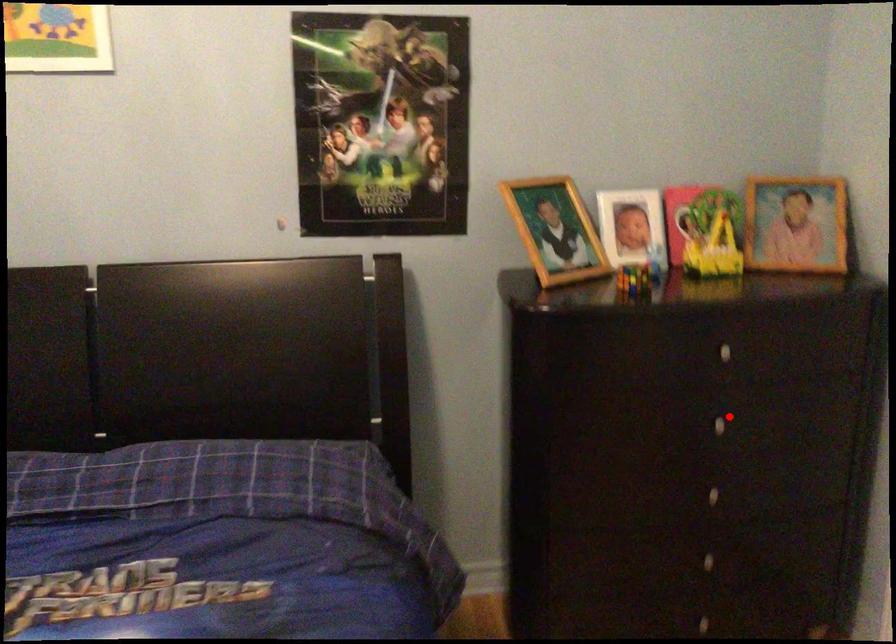
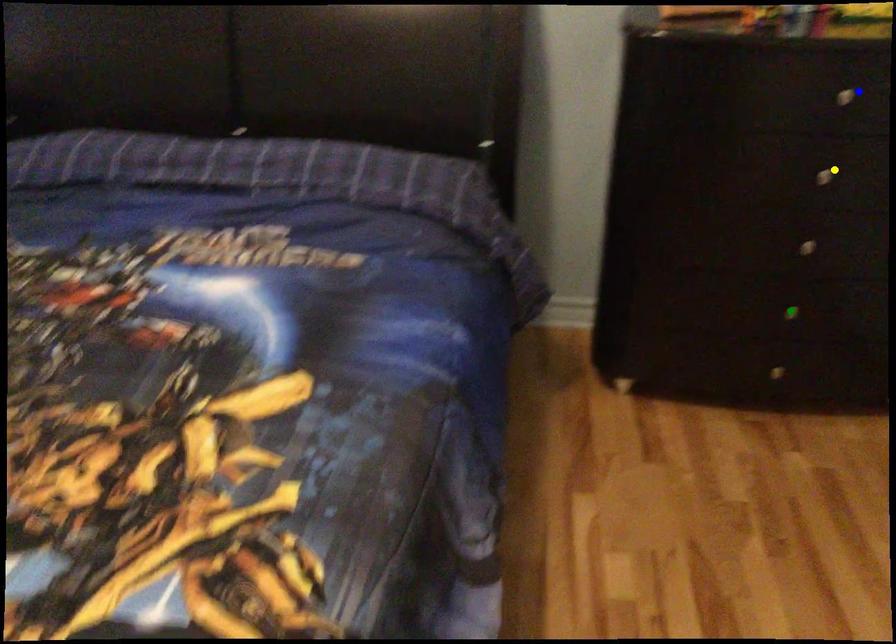
Question: I am providing you with two images of the same scene from different viewpoints. A red point is marked on the first image. You are given multiple points on the second image. Which point in image 2 represents the same 3d spot as the red point in image 1?

Choices:
 (A) green point
 (B) yellow point
 (C) blue point

Answer: (B)